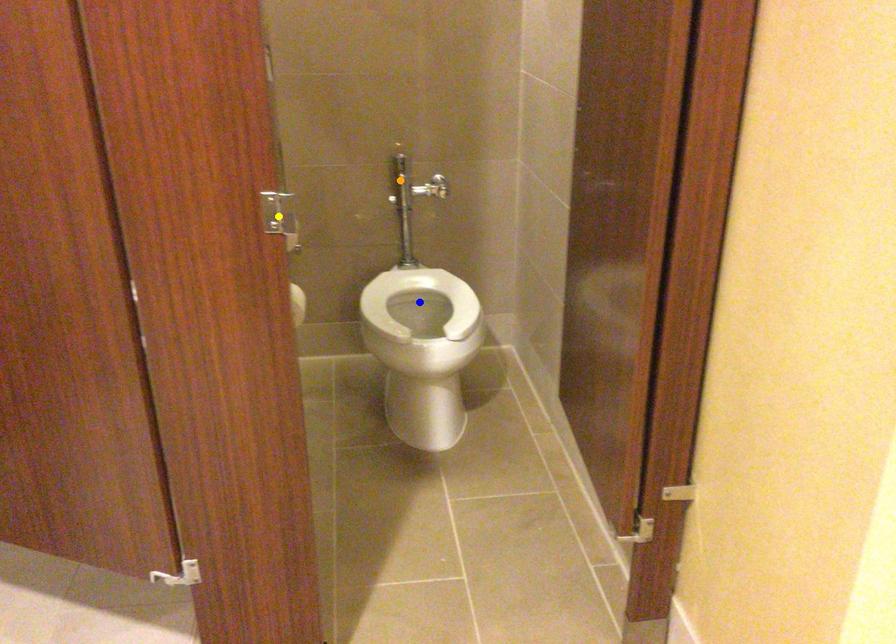
From the picture: Order these from nearest to farthest:
A) blue point
B) orange point
C) yellow point

yellow point
blue point
orange point